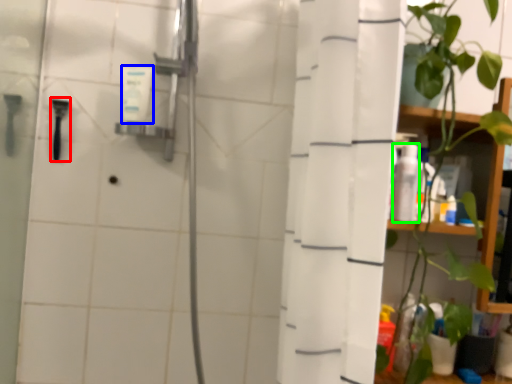
Question: Based on their relative distances, which object is farther from shower (highlighted by a red box)? Choose from toiletry (highlighted by a blue box) and toiletry (highlighted by a green box).

Choices:
 (A) toiletry
 (B) toiletry

Answer: (B)